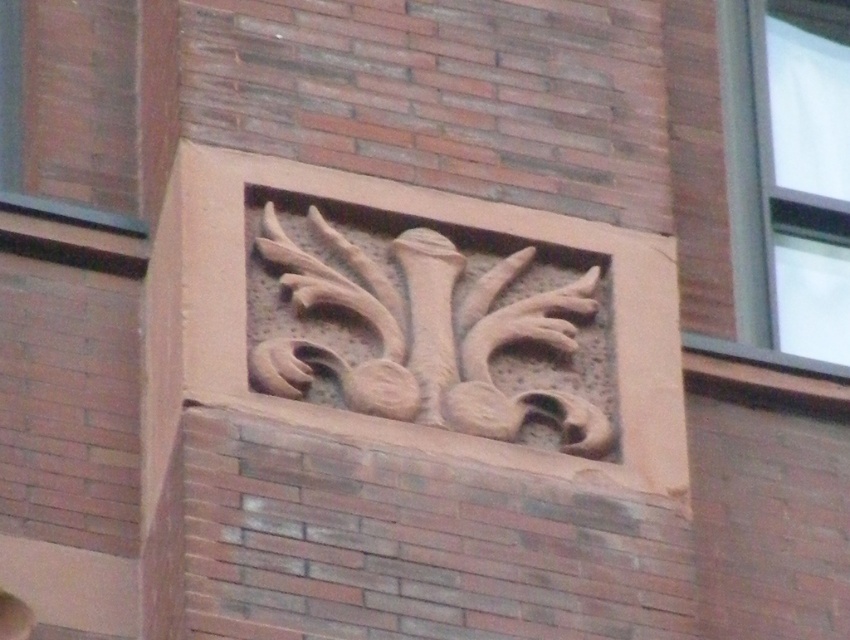
Question: Does brown stone relief at center have a smaller size compared to clear glass window at upper right?

Choices:
 (A) no
 (B) yes

Answer: (B)

Question: Is brown stone relief at center thinner than clear glass window at upper right?

Choices:
 (A) yes
 (B) no

Answer: (B)

Question: Is brown stone relief at center closer to the viewer compared to clear glass window at upper right?

Choices:
 (A) yes
 (B) no

Answer: (A)

Question: Which point is closer to the camera?

Choices:
 (A) (415, 288)
 (B) (799, 156)

Answer: (A)